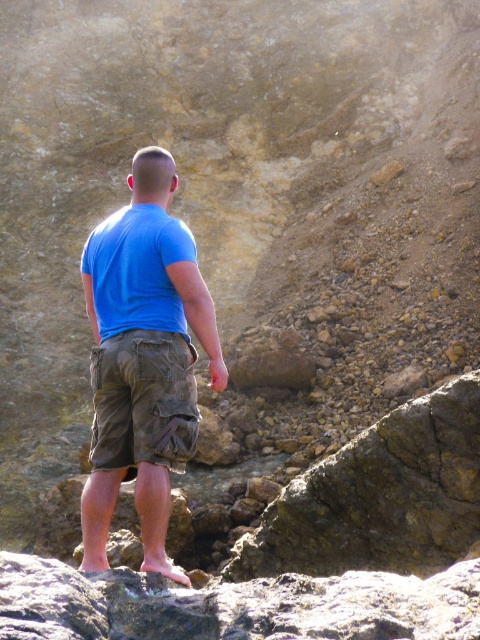
Does blue cotton shirt at center have a larger size compared to olive green canvas shorts at center?

Correct, blue cotton shirt at center is larger in size than olive green canvas shorts at center.

Does blue cotton shirt at center have a greater height compared to olive green canvas shorts at center?

Yes.

Describe the element at coordinates (144, 356) in the screenshot. The width and height of the screenshot is (480, 640). I see `blue cotton shirt at center` at that location.

The image size is (480, 640). Identify the location of blue cotton shirt at center. (144, 356).